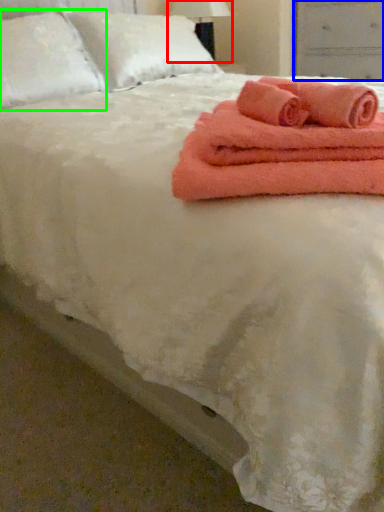
Question: Which object is positioned closest to bedside lamp (highlighted by a red box)? Select from drawer (highlighted by a blue box) and pillow (highlighted by a green box).

Choices:
 (A) drawer
 (B) pillow

Answer: (A)